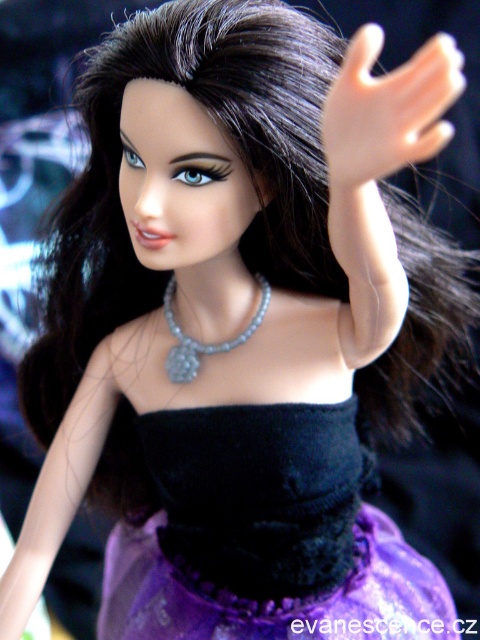
Question: Does purple velvet dress at center appear under pearl-like beads necklace at center?

Choices:
 (A) yes
 (B) no

Answer: (A)

Question: Does purple velvet dress at center appear under translucent plastic hand at upper right?

Choices:
 (A) no
 (B) yes

Answer: (B)

Question: Among these points, which one is nearest to the camera?

Choices:
 (A) (348, 164)
 (B) (261, 298)
 (C) (292, 557)

Answer: (A)

Question: Which point appears farthest from the camera in this image?

Choices:
 (A) (166, 518)
 (B) (212, 348)
 (C) (411, 124)

Answer: (A)

Question: Does purple velvet dress at center have a smaller size compared to pearl-like beads necklace at center?

Choices:
 (A) yes
 (B) no

Answer: (B)

Question: Which of the following is the farthest from the observer?

Choices:
 (A) purple velvet dress at center
 (B) pearl-like beads necklace at center
 (C) translucent plastic hand at upper right

Answer: (B)